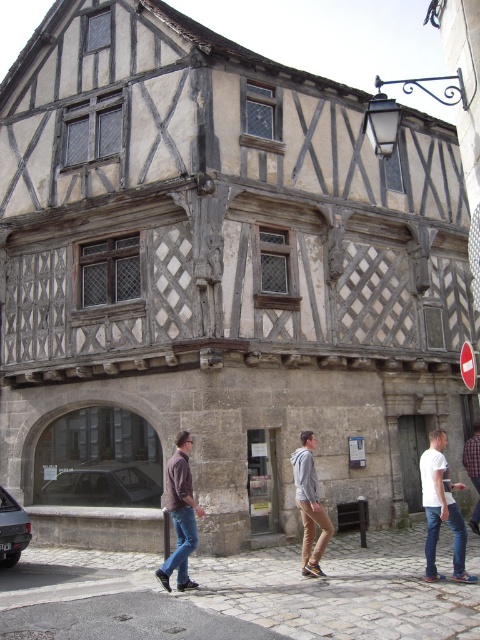
Is white cotton t-shirt at lower right bigger than brown leather jacket at center?

Correct, white cotton t-shirt at lower right is larger in size than brown leather jacket at center.

Measure the distance between white cotton t-shirt at lower right and brown leather jacket at center.

white cotton t-shirt at lower right is 7.71 meters away from brown leather jacket at center.

Does point (455, 554) come farther from viewer compared to point (166, 468)?

No, (455, 554) is closer to viewer.

Locate an element on the screen. The width and height of the screenshot is (480, 640). white cotton t-shirt at lower right is located at coordinates (442, 508).

At what (x,y) coordinates should I click in order to perform the action: click on gray hoodie at center. Please return your answer as a coordinate pair (x, y). The image size is (480, 640). Looking at the image, I should click on (310, 506).

Is gray hoodie at center above denim pants at lower right?

Correct, gray hoodie at center is located above denim pants at lower right.

Where is `gray hoodie at center`? gray hoodie at center is located at coordinates (310, 506).

Does brown leather jacket at center appear under gray hoodie at center?

Incorrect, brown leather jacket at center is not positioned below gray hoodie at center.

Does point (181, 460) come behind point (323, 524)?

No, (181, 460) is closer to viewer.

Who is more distant from viewer, (175, 516) or (312, 438)?

Point (312, 438)

Where is `brown leather jacket at center`? The image size is (480, 640). brown leather jacket at center is located at coordinates (180, 515).